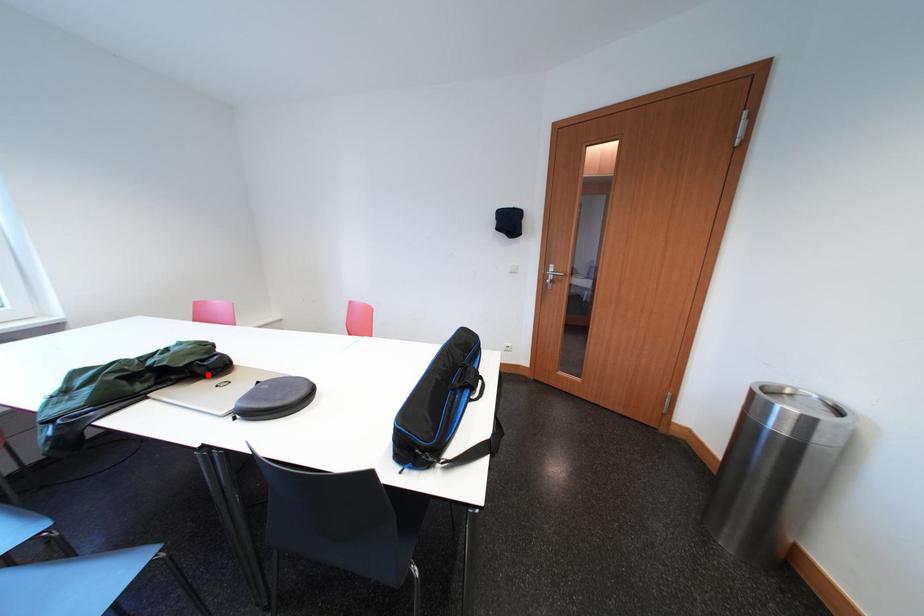
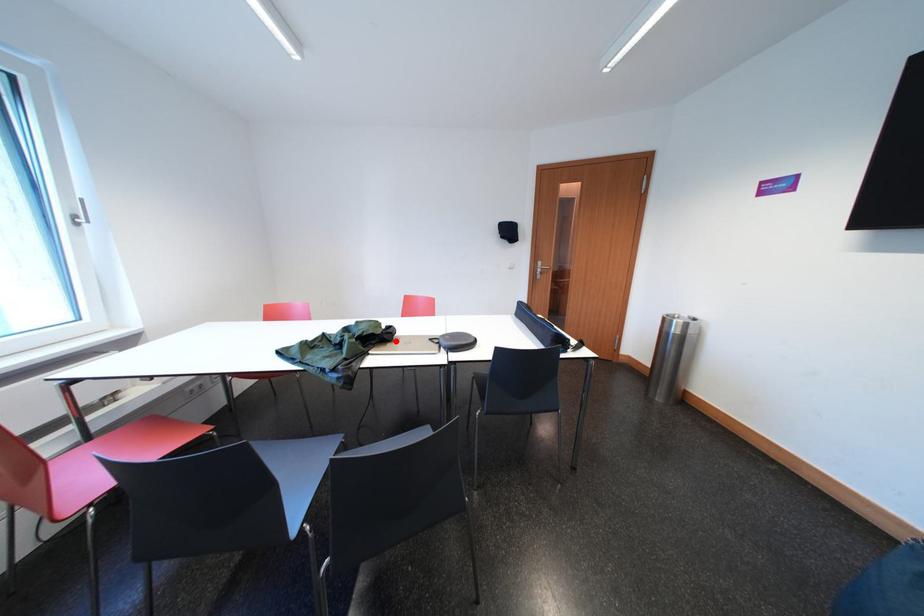
I am providing you with two images of the same scene from different viewpoints. A red point is marked on the first image and another point is marked on the second image. Does the point marked in image1 correspond to the same location as the one in image2?

Yes